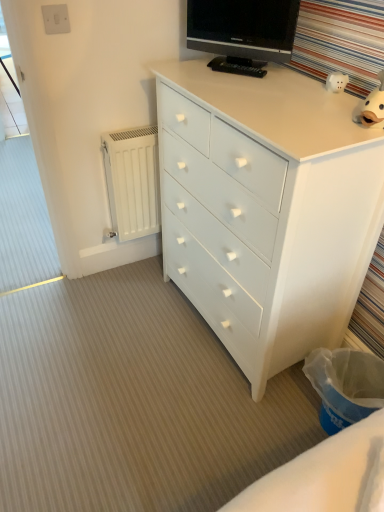
Identify the location of empty space that is ontop of white painted wood chest of drawers at center (from a real-world perspective). (279, 94).